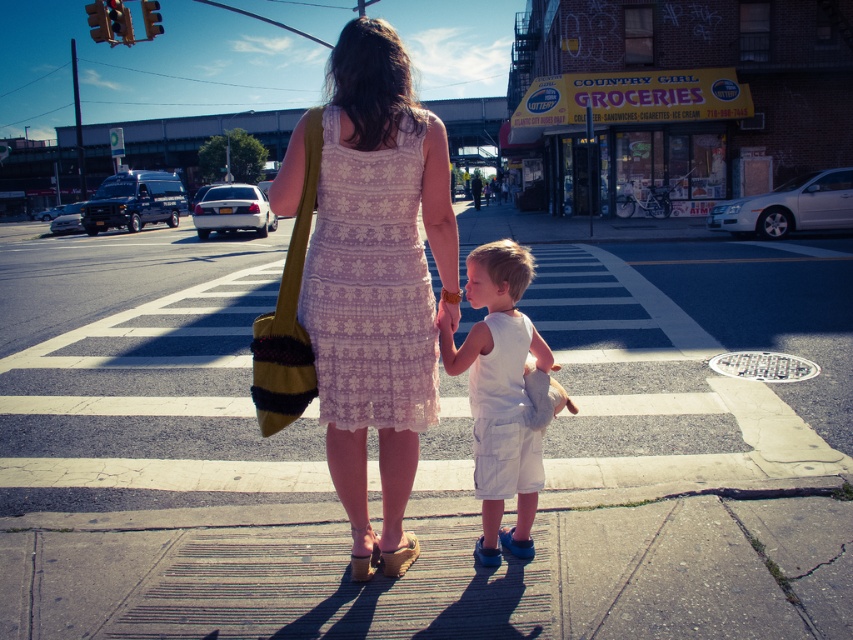
You are a photographer trying to capture a candid shot of the lace fabric dress at center and the white cotton shorts at center. If your camera has a depth of field that can focus on objects within 35 centimeters of each other, will both items be in focus?

The lace fabric dress at center is 36.29 centimeters from white cotton shorts at center. Since the distance between them exceeds the 35 centimeter limit, the camera cannot focus both items simultaneously.

In the scene shown: What are the exact coordinates of the lace fabric dress at center in the image?

The lace fabric dress at center is located at point (370,285).